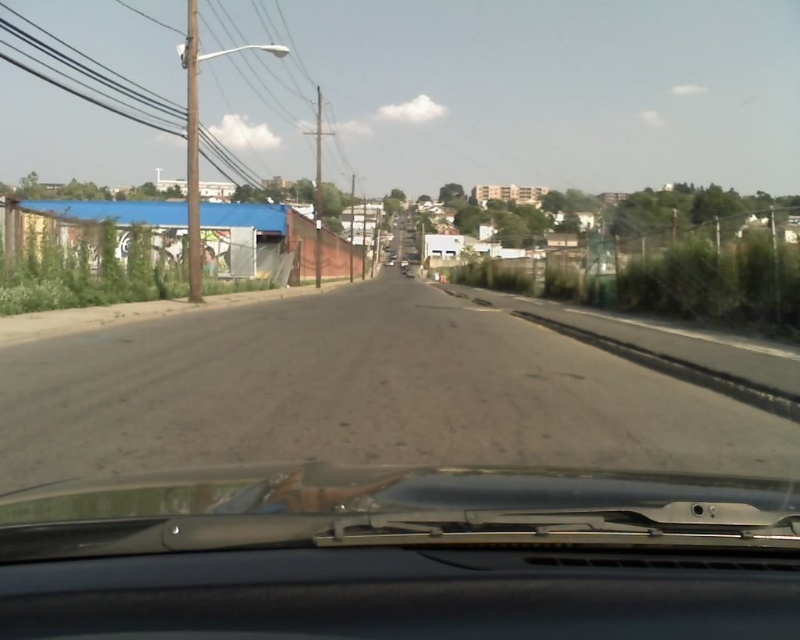
Question: Is black rubber windshield wiper at lower center to the right of dirt track at lower left from the viewer's perspective?

Choices:
 (A) no
 (B) yes

Answer: (B)

Question: Which point is farther from the camera taking this photo?

Choices:
 (A) (38, 529)
 (B) (592, 376)

Answer: (B)

Question: Which object is farther from the camera taking this photo?

Choices:
 (A) black rubber windshield wiper at lower center
 (B) dirt track at lower left

Answer: (B)

Question: Is black rubber windshield wiper at lower center to the left of dirt track at lower left from the viewer's perspective?

Choices:
 (A) no
 (B) yes

Answer: (A)

Question: Can you confirm if black rubber windshield wiper at lower center is positioned above dirt track at lower left?

Choices:
 (A) yes
 (B) no

Answer: (B)